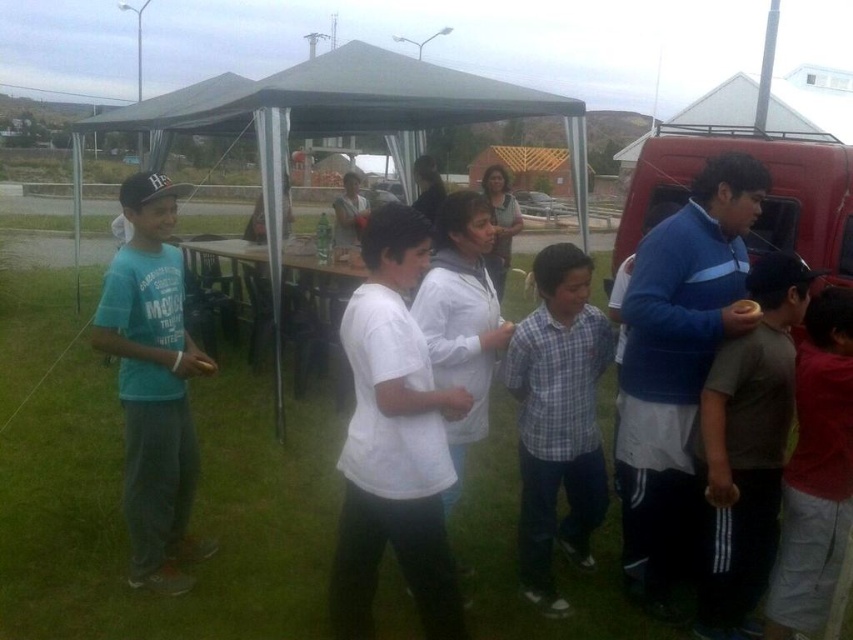
You are standing at point (793, 451) and want to walk to point (525, 529). Is the destination point behind you or in front of you?

The destination point (525, 529) is behind you because it is located behind point (793, 451) where you are standing.

You are standing at the entrance of the green fabric tent at center. If you look towards the direction of the point 0.189, 0.397, where would you be facing?

The green fabric tent at center is located at point (338, 120), so facing that direction would mean you are looking directly at the entrance of the green fabric tent at center.